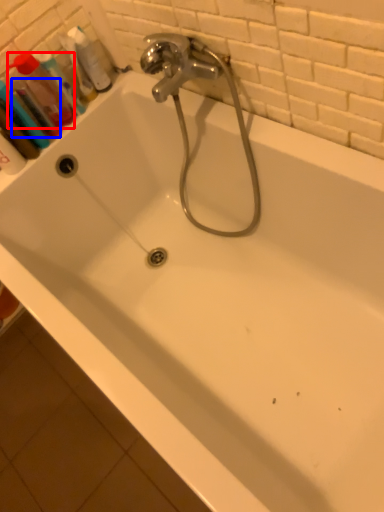
Question: Which object appears closest to the camera in this image, mouthwash (highlighted by a red box) or mouthwash (highlighted by a blue box)?

Choices:
 (A) mouthwash
 (B) mouthwash

Answer: (B)